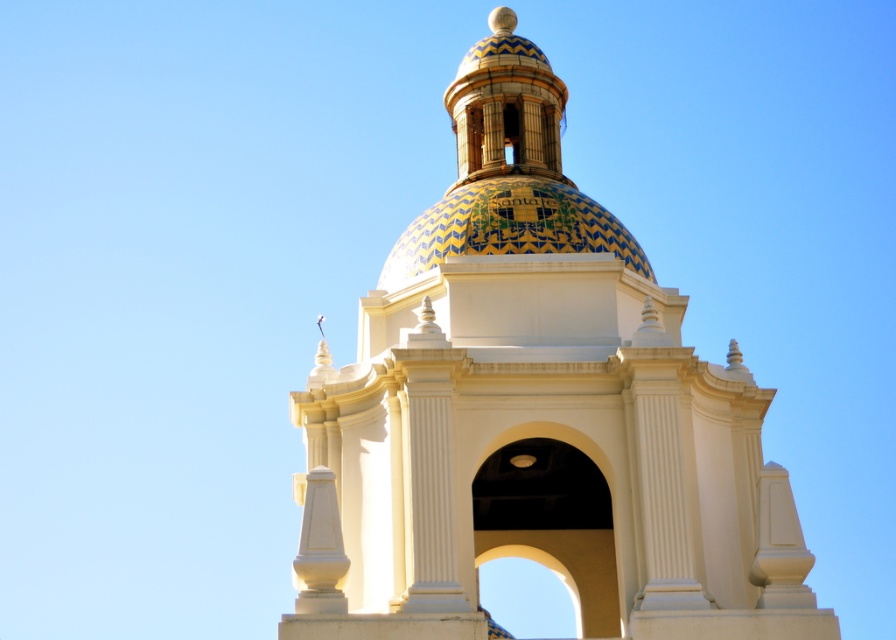
You are an architect examining the building and need to determine the placement of the white ceramic dome at center and the glazed ceramic dome at center. According to the scene, which dome is positioned higher up?

The glazed ceramic dome at center is positioned higher up since the white ceramic dome at center is located below it.

You are an architect designing a miniature model of this building. You have two domes available for the central structure. The white ceramic dome at center and the glazed ceramic dome at center. Which dome should you choose if you want the central structure to have a wider base for stability?

You should choose the white ceramic dome at center because its width is larger than the glazed ceramic dome at center, providing a wider base for stability.